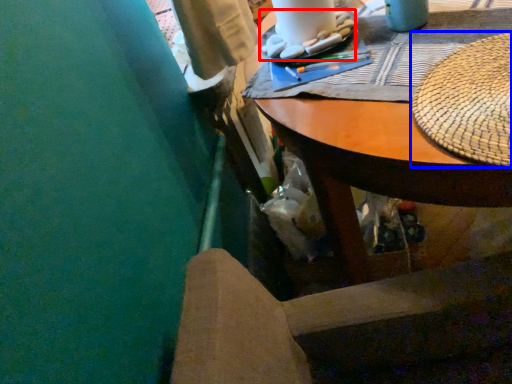
Question: Which point is further to the camera, food (highlighted by a red box) or hat (highlighted by a blue box)?

Choices:
 (A) food
 (B) hat

Answer: (A)